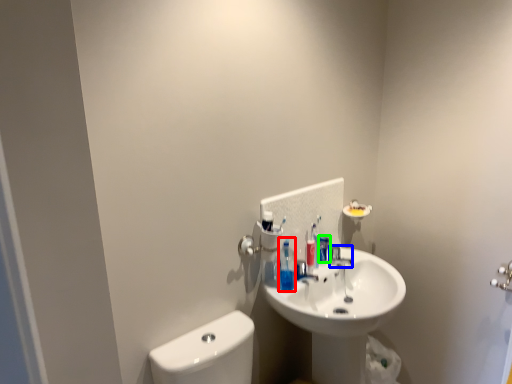
Question: Considering the real-world distances, which object is farthest from toiletry (highlighted by a red box)? plumbing fixture (highlighted by a blue box) or mouthwash (highlighted by a green box)?

Choices:
 (A) plumbing fixture
 (B) mouthwash

Answer: (A)